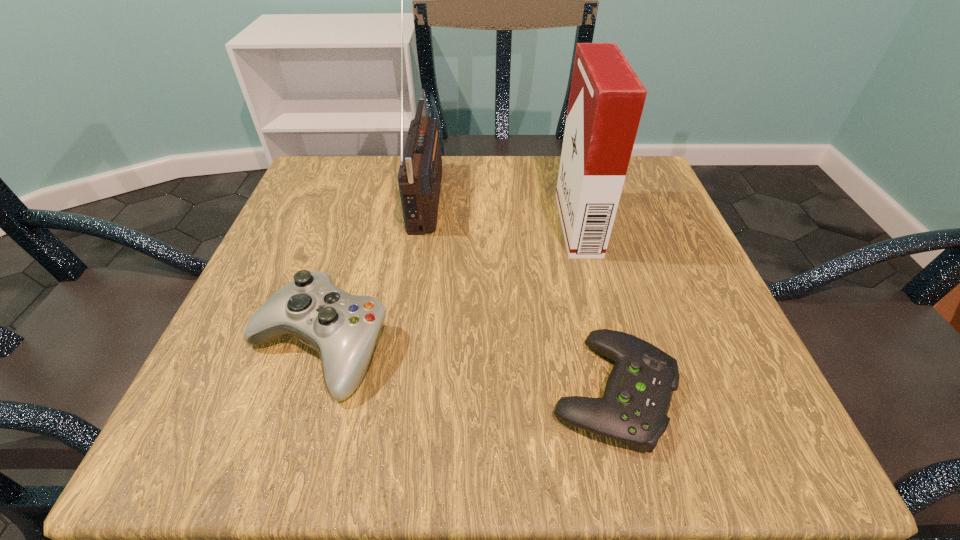
What are the coordinates of `free space at the left edge of the desktop` in the screenshot? It's located at (239, 371).

The width and height of the screenshot is (960, 540). Identify the location of vacant area at the right edge. (627, 305).

You are a GUI agent. You are given a task and a screenshot of the screen. Output one action in this format:
    pyautogui.click(x=<x>, y=<y>)
    Task: Click on the free space at the far left corner of the desktop
    The height and width of the screenshot is (540, 960).
    Given the screenshot: What is the action you would take?
    pyautogui.click(x=352, y=185)

In the image, there is a desktop. Identify the location of free region at the near right corner. (786, 448).

Where is `free spot between the shorter control and the cigarette_case`? The width and height of the screenshot is (960, 540). free spot between the shorter control and the cigarette_case is located at coordinates (595, 307).

Identify the location of free area in between the taller control and the radio receiver. This screenshot has width=960, height=540. (372, 271).

Locate an element on the screen. free point between the taller control and the right control is located at coordinates (466, 368).

Locate an element on the screen. This screenshot has height=540, width=960. empty space between the radio receiver and the cigarette_case is located at coordinates (502, 210).

At what (x,y) coordinates should I click in order to perform the action: click on empty space that is in between the shorter control and the cigarette_case. Please return your answer as a coordinate pair (x, y). The image size is (960, 540). Looking at the image, I should click on click(x=595, y=307).

Identify the location of unoccupied area between the cigarette_case and the right control. click(x=595, y=307).